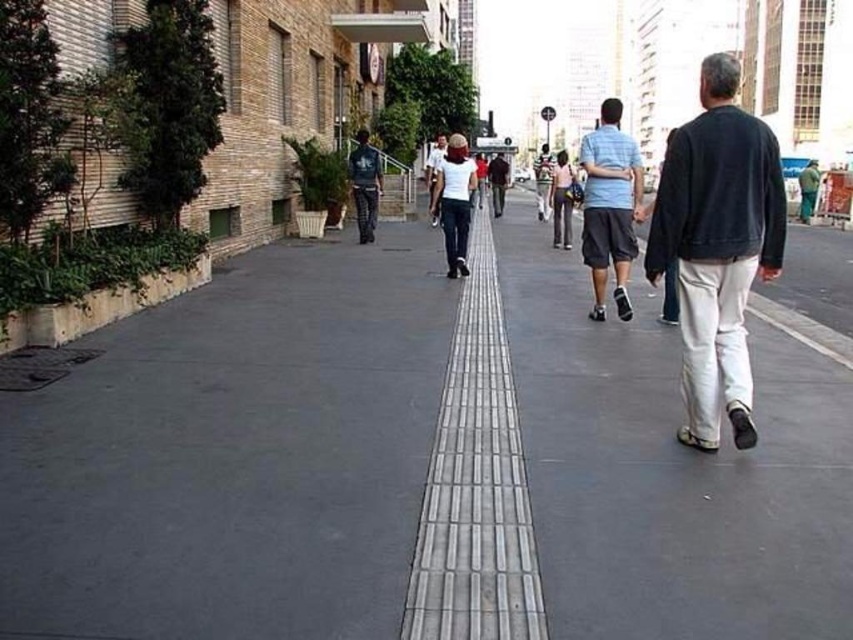
You are a fashion designer observing two individuals on a busy street. You notice a light blue striped shirt at center and a white shirt at center. Which shirt has a shorter length?

The light blue striped shirt at center is shorter than the white shirt at center.

You are a delivery person standing at the start of the street. You need to deliver a package to the dark blue jeans at center. According to the map coordinates, where should you head?

The dark blue jeans at center is located at coordinates point (364, 184), so you should head towards that coordinate point.

You are a delivery drone flying above the urban street scene. You need to navigate between two specific points to deliver a package. The points are labeled as point 1 at coordinates point (352, 189) and point 2 at coordinates point (434, 141). Which point should you approach first if you want to follow the path that goes from the closer point to the farther one?

Point 1 at coordinates point (352, 189) is closer to you than point 2 at coordinates point (434, 141), so you should approach point 1 first.